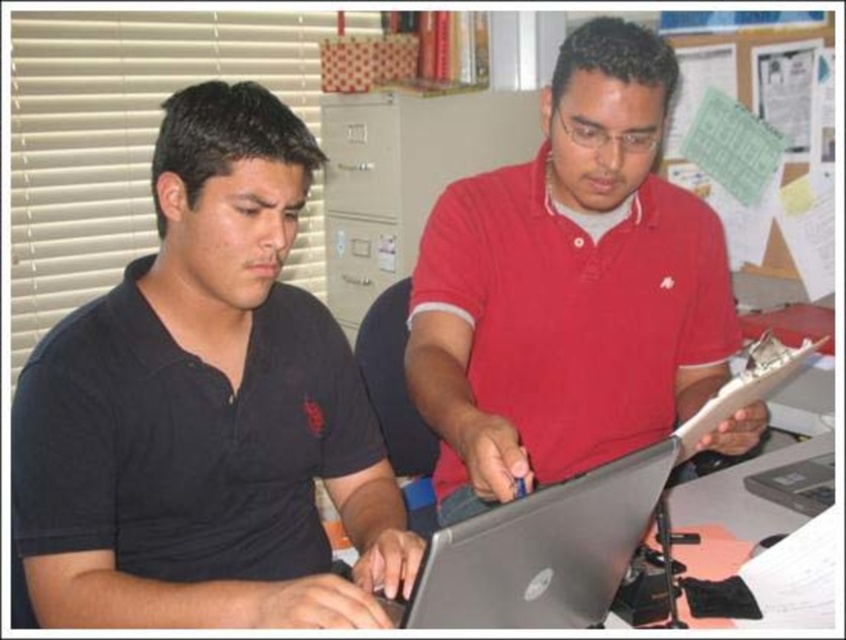
You are a new employee in an office and need to locate the person wearing the black matte shirt at left and the matte red shirt at center. Based on their positions, which one is sitting lower in the seating arrangement?

The black matte shirt at left is located below the matte red shirt at center, so the person wearing the black matte shirt at left is sitting lower in the seating arrangement.

You are a delivery person who needs to place a small package on the desk. The package is exactly as tall as the white paper at lower right. Can you safely place the package on top of the silver metallic laptop at center without it being taller than the laptop?

The silver metallic laptop at center has a greater height compared to white paper at lower right. Since the package is the same height as the white paper, placing it on the laptop would not exceed the laptop height. However, the desk has other items like papers and a notepad, so ensure there is enough space. The height is acceptable, but check for physical space.

You are a security guard in an office building. You need to locate the person wearing a matte red shirt at center. According to the coordinates provided, where should you look to find this individual?

The matte red shirt at center is located at point (569, 288), so you should look there to find the individual.